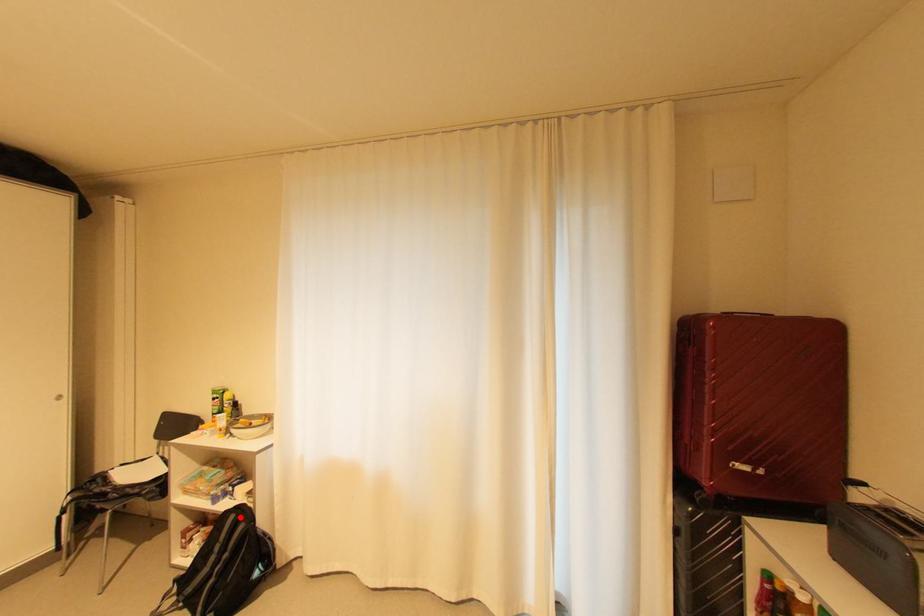
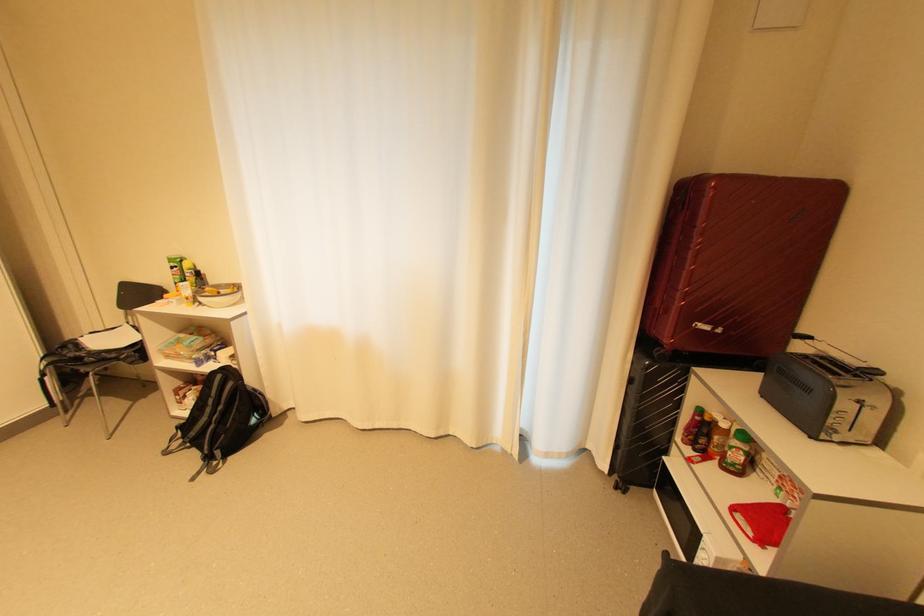
Where in the second image is the point corresponding to the highlighted location from the first image?

(226, 377)